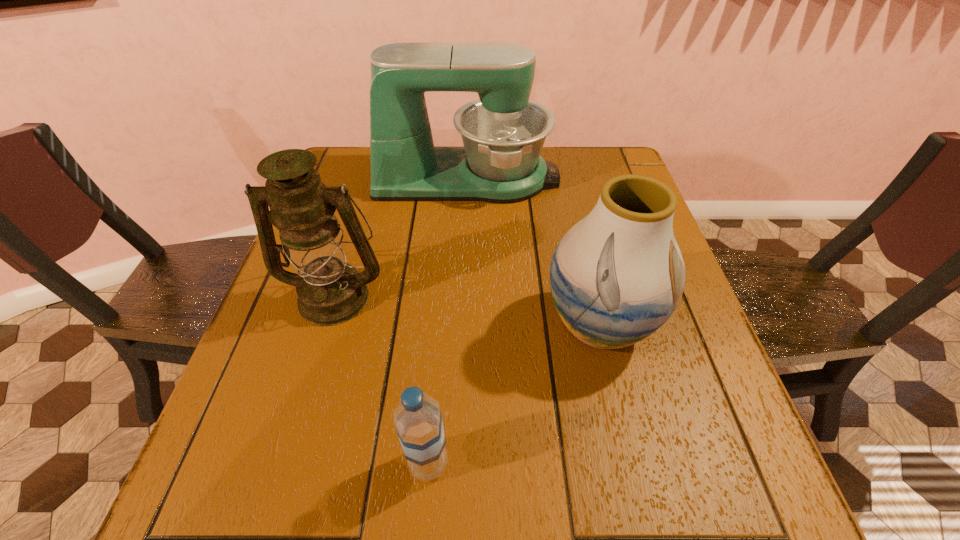
This screenshot has width=960, height=540. What are the coordinates of `vacant region between the nearest object and the mixer` in the screenshot? It's located at (447, 321).

Image resolution: width=960 pixels, height=540 pixels. I want to click on free spot between the farthest object and the oil lamp, so click(401, 237).

The height and width of the screenshot is (540, 960). I want to click on vacant area that lies between the water bottle and the vase, so click(514, 394).

The width and height of the screenshot is (960, 540). In order to click on free space between the oil lamp and the shortest object in this screenshot , I will do `click(381, 380)`.

This screenshot has height=540, width=960. Identify the location of vacant area between the shortest object and the vase. (514, 394).

This screenshot has height=540, width=960. I want to click on vacant area that lies between the oil lamp and the nearest object, so click(x=381, y=380).

At what (x,y) coordinates should I click in order to perform the action: click on free space that is in between the mixer and the oil lamp. Please return your answer as a coordinate pair (x, y). The image size is (960, 540). Looking at the image, I should click on (401, 237).

Where is `free space between the nearest object and the oil lamp`? free space between the nearest object and the oil lamp is located at coordinates (381, 380).

Where is `the third closest object relative to the oil lamp`? Image resolution: width=960 pixels, height=540 pixels. the third closest object relative to the oil lamp is located at coordinates (616, 276).

You are a GUI agent. You are given a task and a screenshot of the screen. Output one action in this format:
    pyautogui.click(x=<x>, y=<y>)
    Task: Click on the second closest object to the nearest object
    This screenshot has height=540, width=960.
    Given the screenshot: What is the action you would take?
    pyautogui.click(x=330, y=291)